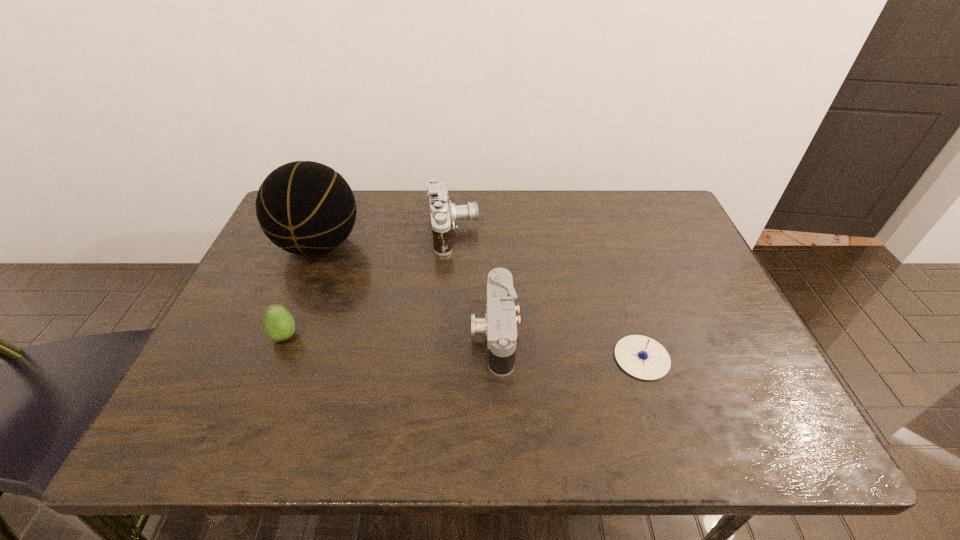
Image resolution: width=960 pixels, height=540 pixels. Find the location of `basketball`. basketball is located at coordinates (306, 208).

This screenshot has width=960, height=540. I want to click on the farther camera, so click(444, 214).

Identify the location of the nearer camera. (499, 326).

Identify the location of avocado. (278, 323).

Identify the location of the rightmost object. (642, 357).

Locate an element on the screen. This screenshot has height=540, width=960. compass is located at coordinates (642, 357).

The height and width of the screenshot is (540, 960). I want to click on free region located 0.080m on the front of the basketball, so click(x=299, y=296).

Where is `free location located 0.230m at the lens of the farther camera`? free location located 0.230m at the lens of the farther camera is located at coordinates [x=556, y=232].

Find the location of a particular element. This screenshot has height=540, width=960. vacant space located on the lens of the nearer camera is located at coordinates (314, 333).

This screenshot has height=540, width=960. What are the coordinates of `vacant area situated on the lens of the nearer camera` in the screenshot? It's located at (305, 333).